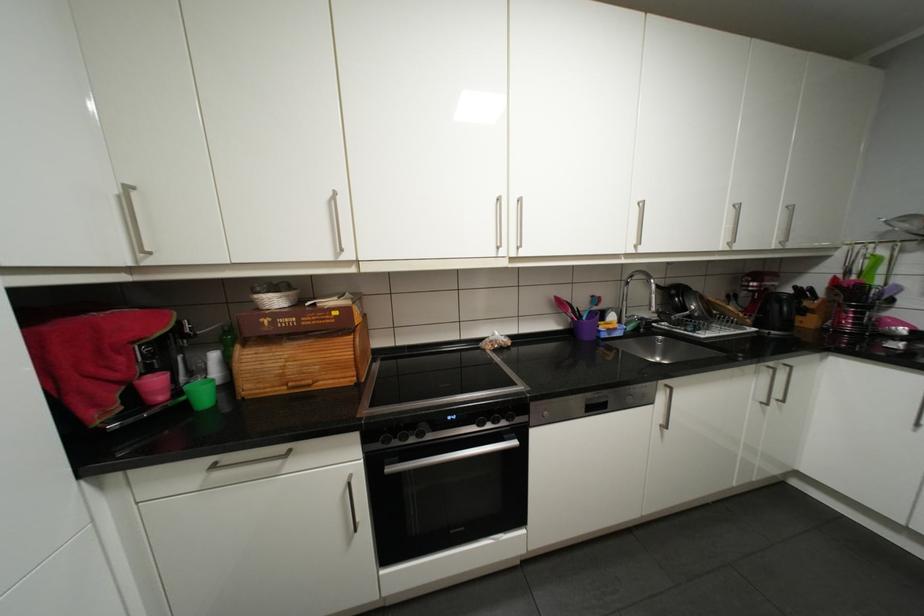
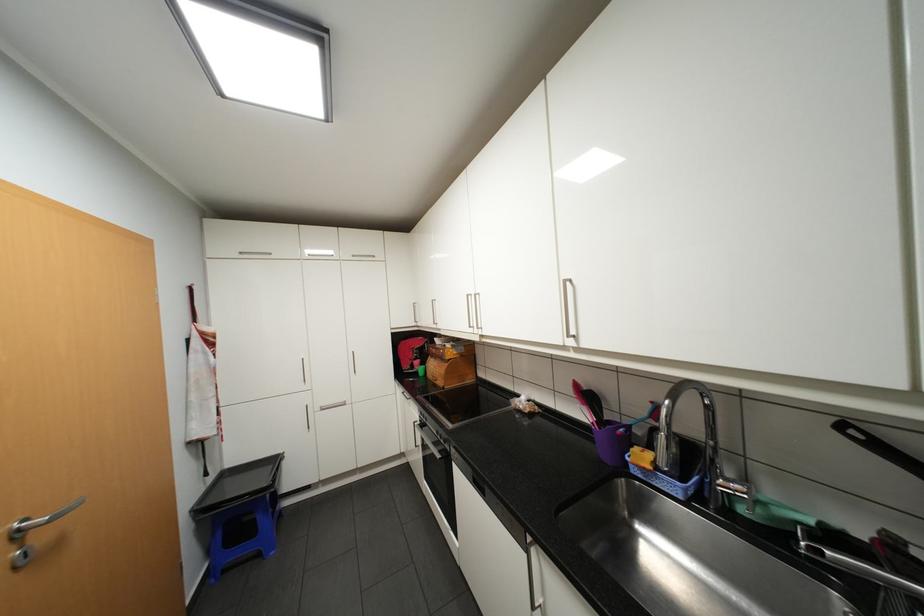
Locate, in the second image, the point that corresponds to the point at 251,344 in the first image.

(440, 355)